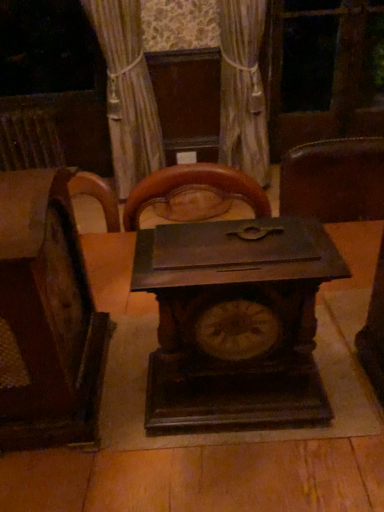
Identify the location of free location above dark brown wood clock at center (from a real-world perspective). (233, 245).